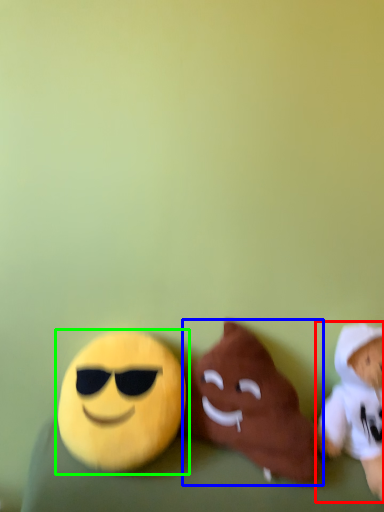
Question: Considering the real-world distances, which object is farthest from toy (highlighted by a red box)? toy (highlighted by a blue box) or toy (highlighted by a green box)?

Choices:
 (A) toy
 (B) toy

Answer: (B)